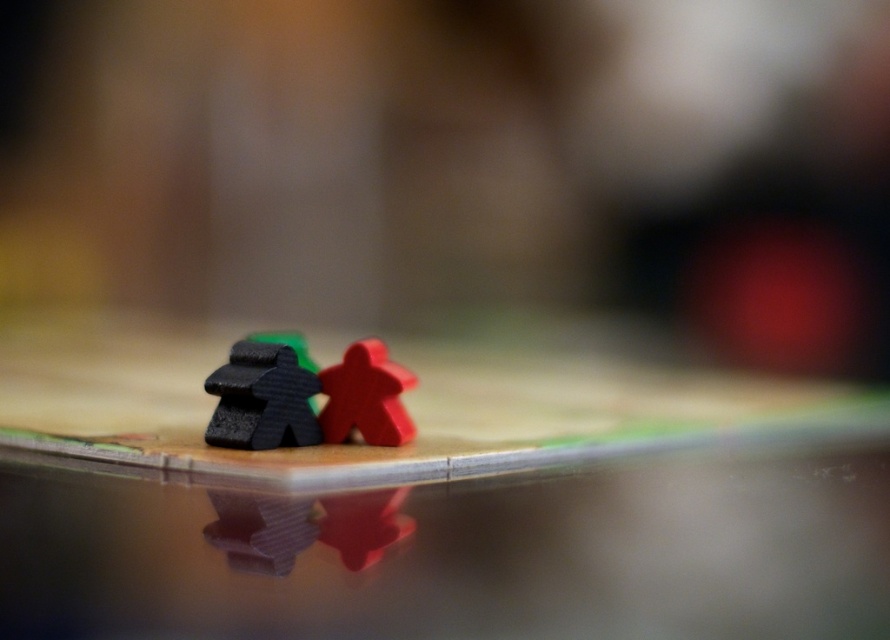
You are a player trying to place a new game piece on the board. The new piece has a diameter of 1.5 inches. You need to ensure it can fit within the space between the matte black meeples at center and the edge of the board, which is 2 feet away from the camera. Can the new piece fit?

The matte black meeples at center are 3.28 feet away from the camera, and the edge of the board is 2 feet away from the camera. This means the distance between the matte black meeples at center and the edge is 1.28 feet. Converting to inches, that is approximately 15.36 inches. Since the new piece has a diameter of 1.5 inches, it can easily fit within this space.

You are playing a board game and need to move your piece closer to the opponent. Your piece is at point (474, 538) and theirs is at (342, 396). Which direction should you move your piece to get closer?

You should move your piece towards point (342, 396) because it is further away from you than point (474, 538), which is already closer to the viewer.

You are playing a board game and need to determine the order of your moves based on the position of the game pieces. Which of the two meeples, the matte black meeples at center or the matte plastic meeples at center, is closer to you?

The matte black meeples at center is closer to you because it is in front of the matte plastic meeples at center.